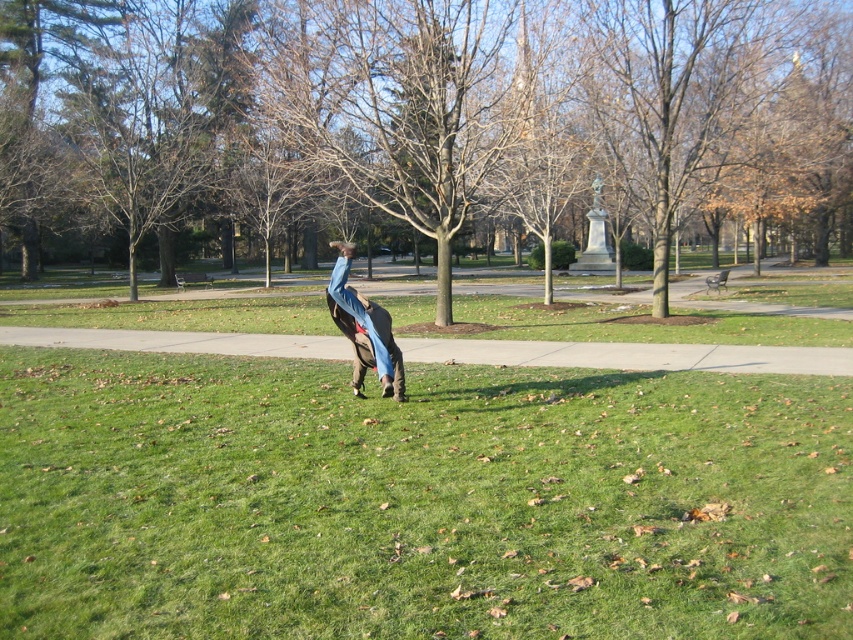
You are a park visitor who wants to find a spot to picnic. You see the green grass at center and the brown wood tree at center. Which location would provide shade from the sun if the tree is overhead?

The green grass at center is positioned under brown wood tree at center, so the green grass at center would be shaded by the tree.

You are standing in the park and see the green grass at center and the denim pants at center. Which object is located to the right side from your perspective?

The green grass at center is to the right of the denim pants at center.